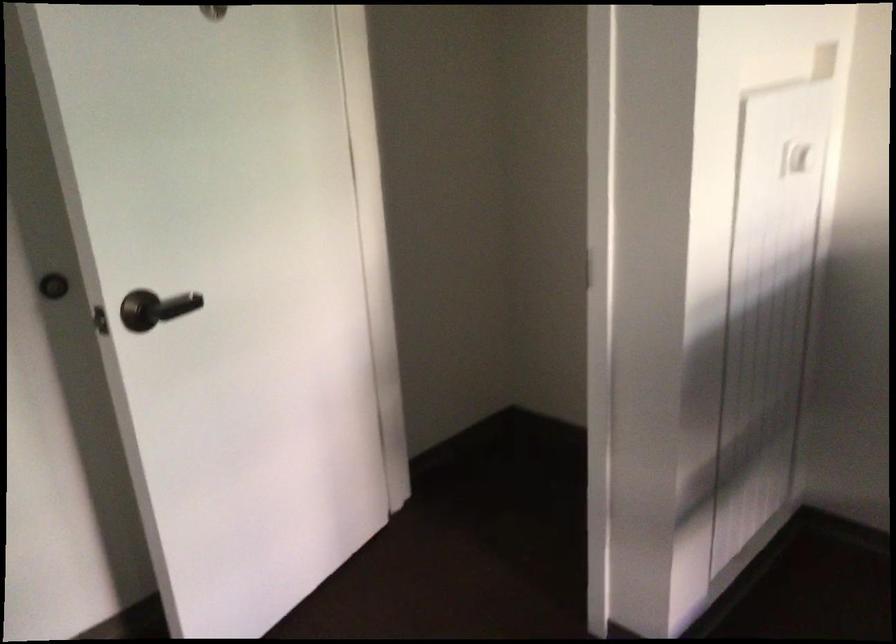
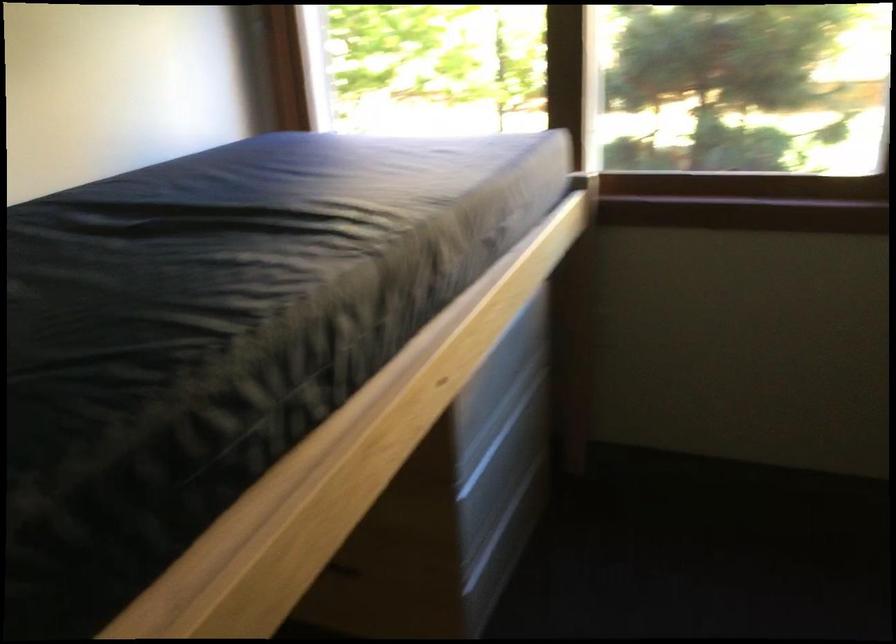
How did the camera likely rotate?

The rotation direction of the camera is right-down.